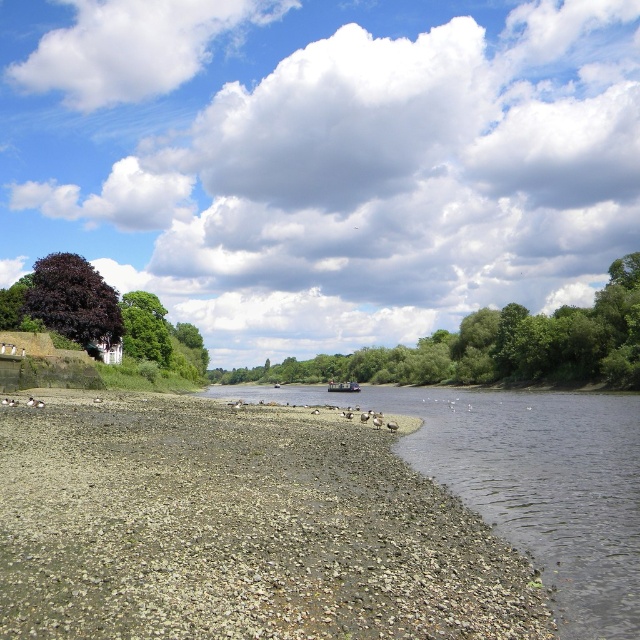
Which of these two, green leafy tree at center or purple-leaved tree at upper left, stands taller?

With more height is green leafy tree at center.

Is green leafy tree at center to the left of purple-leaved tree at upper left from the viewer's perspective?

In fact, green leafy tree at center is to the right of purple-leaved tree at upper left.

Does point (627, 276) lie in front of point (106, 326)?

No, it is behind (106, 326).

The width and height of the screenshot is (640, 640). I want to click on green leafy tree at center, so click(496, 346).

This screenshot has height=640, width=640. I want to click on green leafy tree at center, so click(496, 346).

Between point (602, 323) and point (330, 388), which one is positioned behind?

Positioned behind is point (330, 388).

Measure the distance between green leafy tree at center and camera.

A distance of 91.96 meters exists between green leafy tree at center and camera.

Identify the location of green leafy tree at center. (496, 346).

Is gray gravel shore at lower left wider than metallic gray boat at center?

Correct, the width of gray gravel shore at lower left exceeds that of metallic gray boat at center.

Does gray gravel shore at lower left come behind metallic gray boat at center?

No, it is not.

Which is behind, point (179, 536) or point (348, 392)?

Positioned behind is point (348, 392).

Locate an element on the screen. The image size is (640, 640). gray gravel shore at lower left is located at coordinates (237, 531).